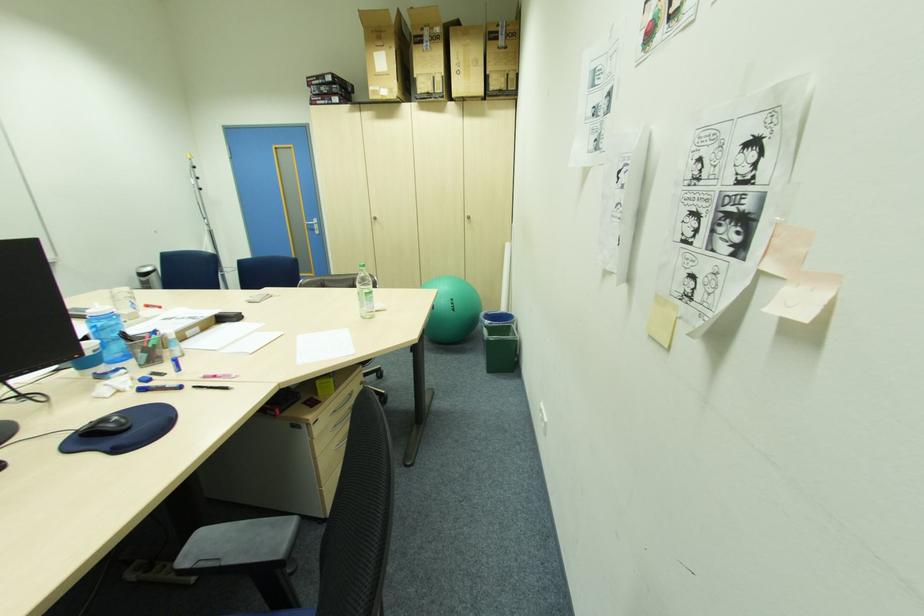
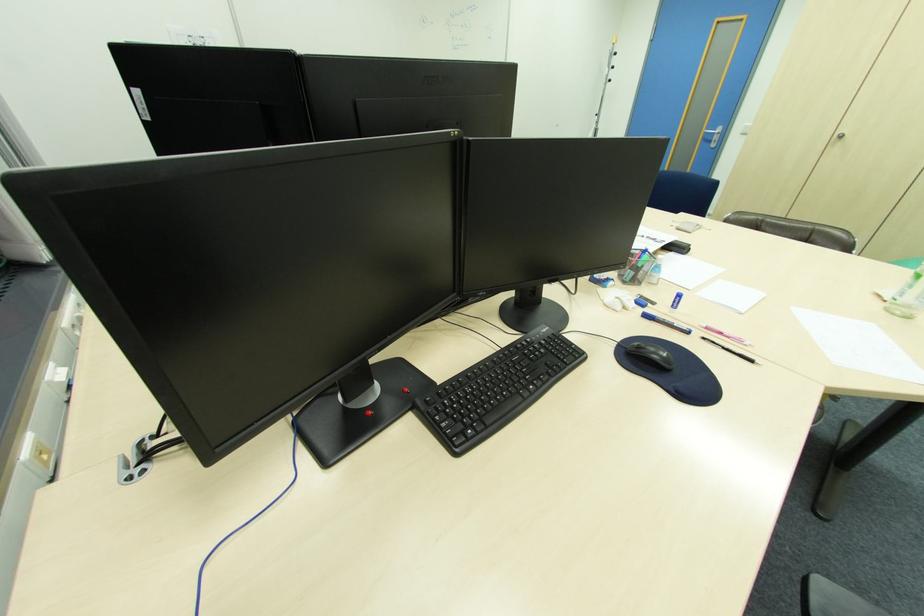
In the second image, find the point that corresponds to point (147, 391) in the first image.

(651, 315)